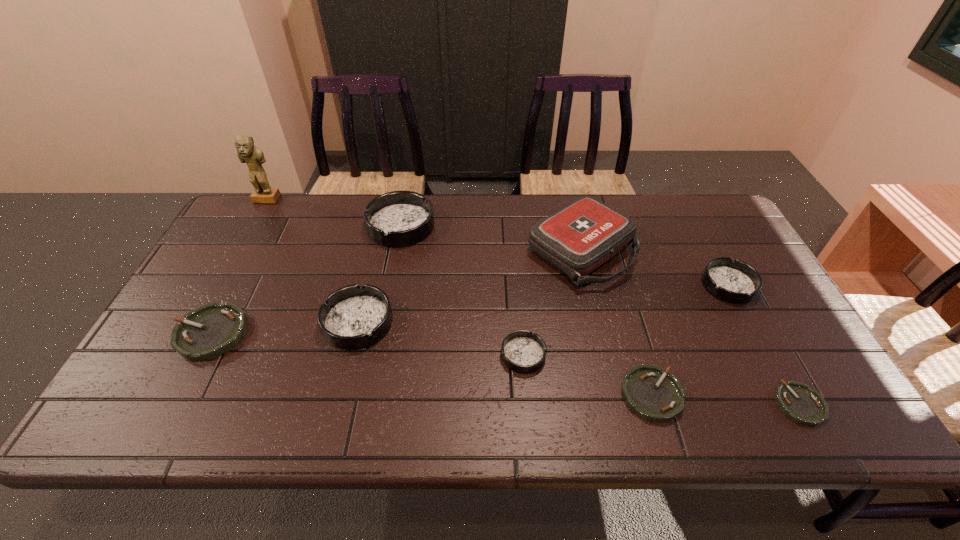
Locate an element on the screen. This screenshot has height=540, width=960. ashtray situated at the left edge is located at coordinates (211, 330).

Identify the location of object at the far left corner. (253, 156).

In order to click on object at the near right corner in this screenshot , I will do `click(796, 400)`.

Where is `blank space at the far edge`? blank space at the far edge is located at coordinates click(681, 231).

This screenshot has height=540, width=960. In the image, there is a desktop. Identify the location of blank space at the near edge. (478, 420).

At what (x,y) coordinates should I click in order to perform the action: click on vacant space at the left edge of the desktop. Please return your answer as a coordinate pair (x, y). This screenshot has width=960, height=540. Looking at the image, I should click on (236, 241).

The height and width of the screenshot is (540, 960). In the image, there is a desktop. What are the coordinates of `free region at the far left corner` in the screenshot? It's located at (224, 236).

Where is `free space at the far right corner of the desktop`? Image resolution: width=960 pixels, height=540 pixels. free space at the far right corner of the desktop is located at coordinates (700, 228).

Locate an element on the screen. The width and height of the screenshot is (960, 540). vacant area between the farthest green ashtray and the second biggest dark ashtray is located at coordinates (284, 328).

This screenshot has width=960, height=540. I want to click on free space between the rightmost dark ashtray and the leftmost green ashtray, so click(469, 309).